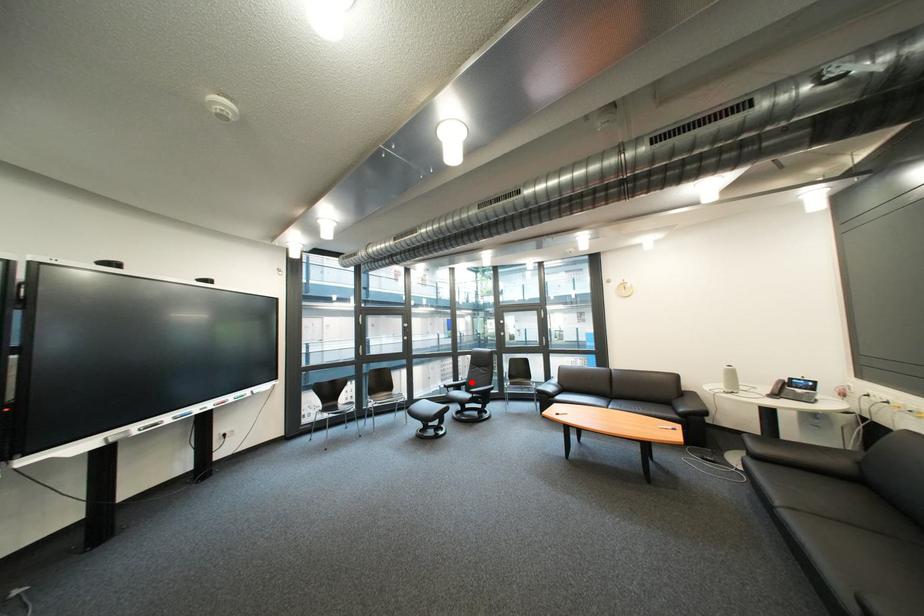
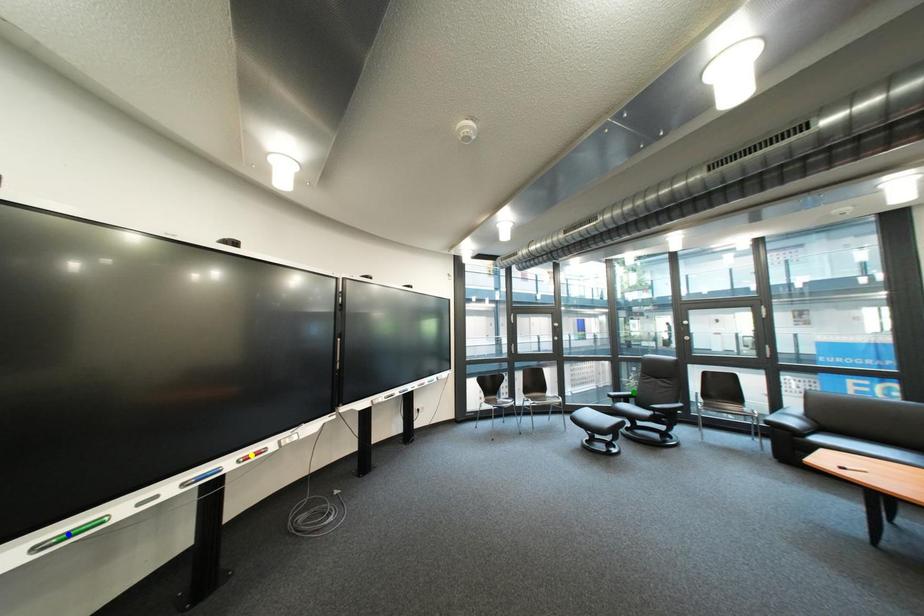
Question: I am providing you with two images of the same scene from different viewpoints. A red point is marked on the first image. You are given multiple points on the second image. Which spot in image 2 lines up with the point in image 1?

Choices:
 (A) green point
 (B) yellow point
 (C) blue point

Answer: (A)